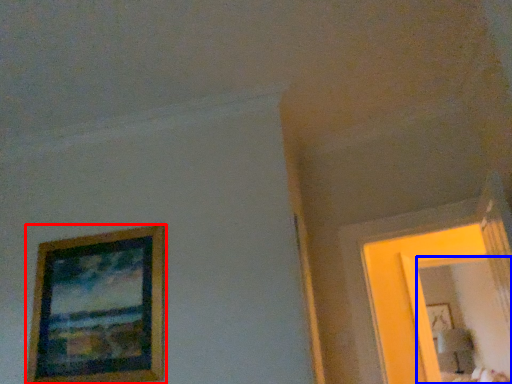
Question: Which point is closer to the camera, picture frame (highlighted by a red box) or mirror (highlighted by a blue box)?

Choices:
 (A) picture frame
 (B) mirror

Answer: (A)